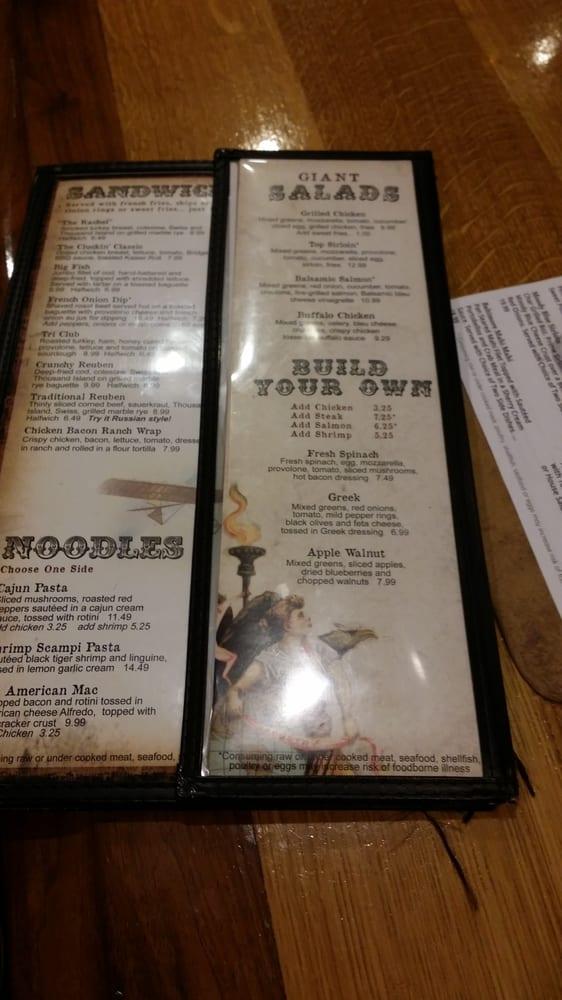
This screenshot has width=562, height=1000. In order to click on plastic covering in this screenshot , I will do `click(248, 194)`, `click(420, 659)`, `click(149, 619)`, `click(143, 570)`.